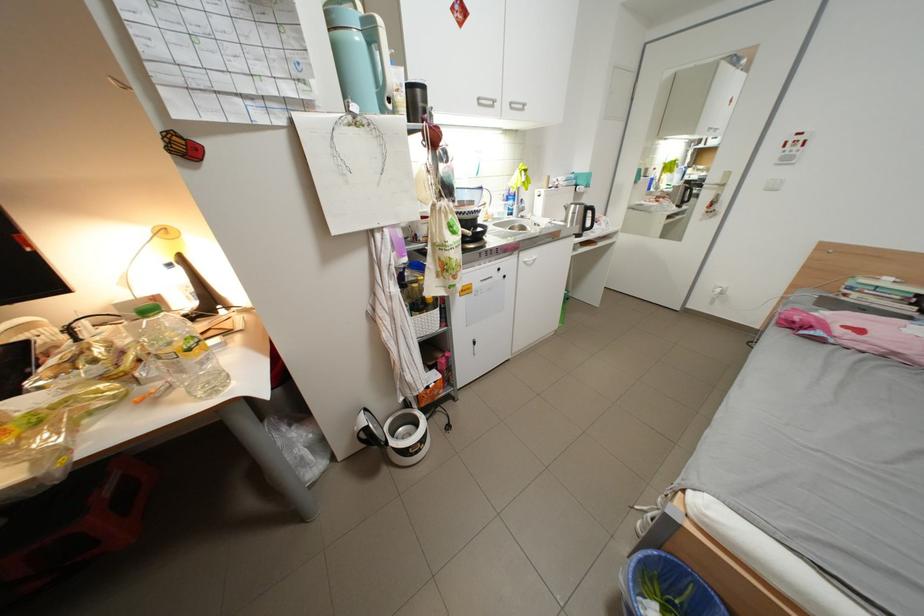
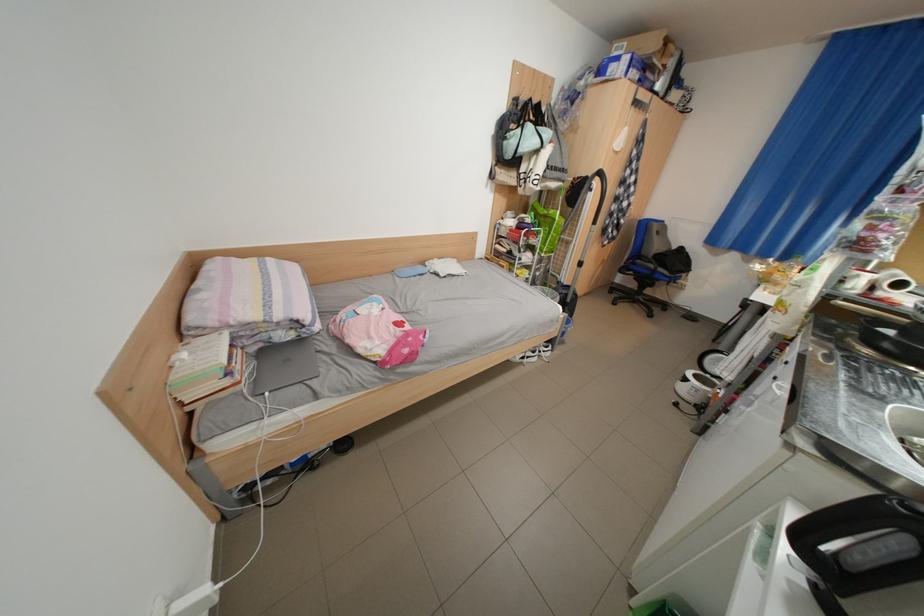
Where in the second image is the point corresponding to (516,278) from the first image?

(786, 379)